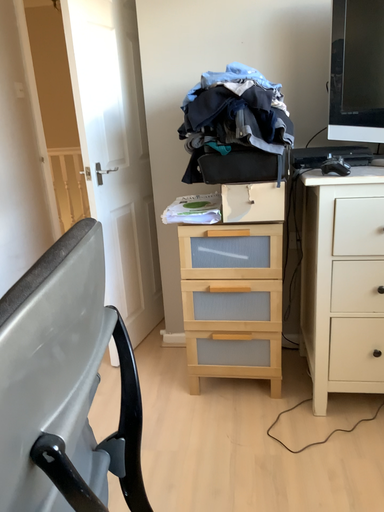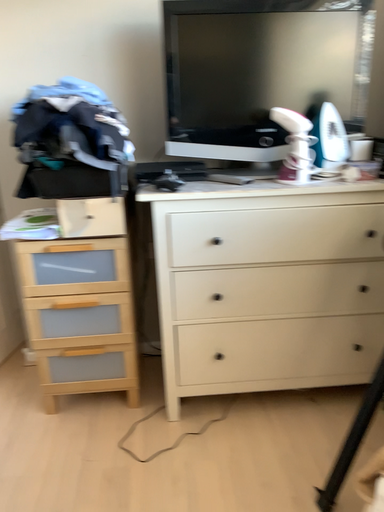
Question: How did the camera likely rotate when shooting the video?

Choices:
 (A) rotated right
 (B) rotated left

Answer: (A)